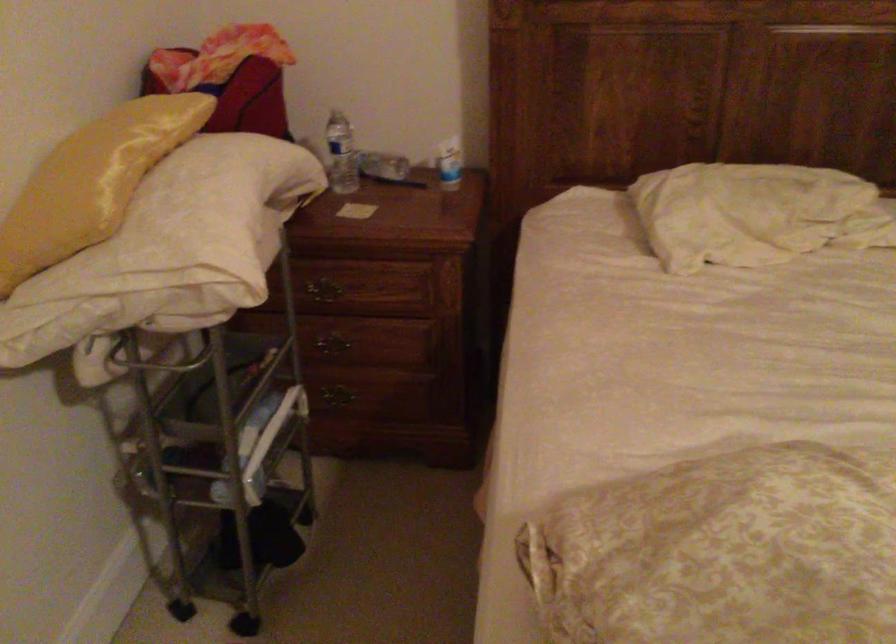
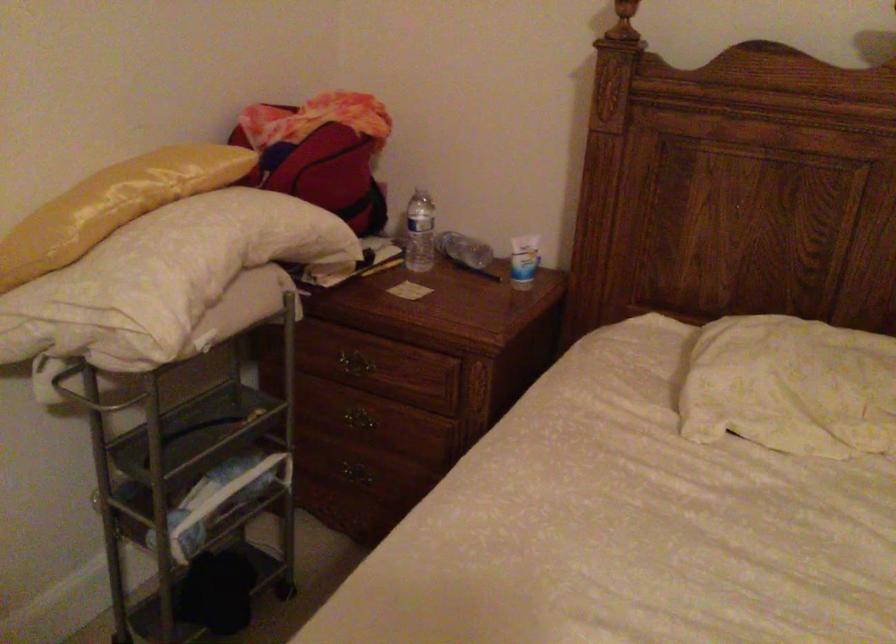
Where in the second image is the point corresponding to point (128, 172) from the first image?

(113, 205)